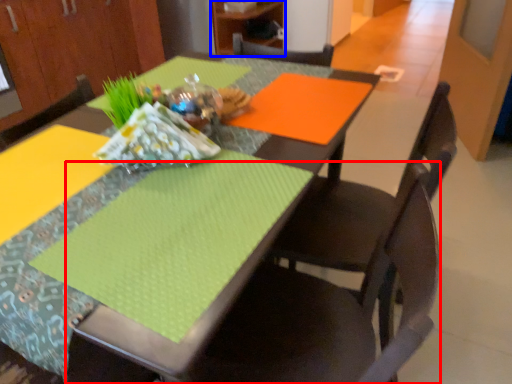
Question: Which of the following is the closest to the observer, chair (highlighted by a red box) or cabinetry (highlighted by a blue box)?

Choices:
 (A) chair
 (B) cabinetry

Answer: (A)